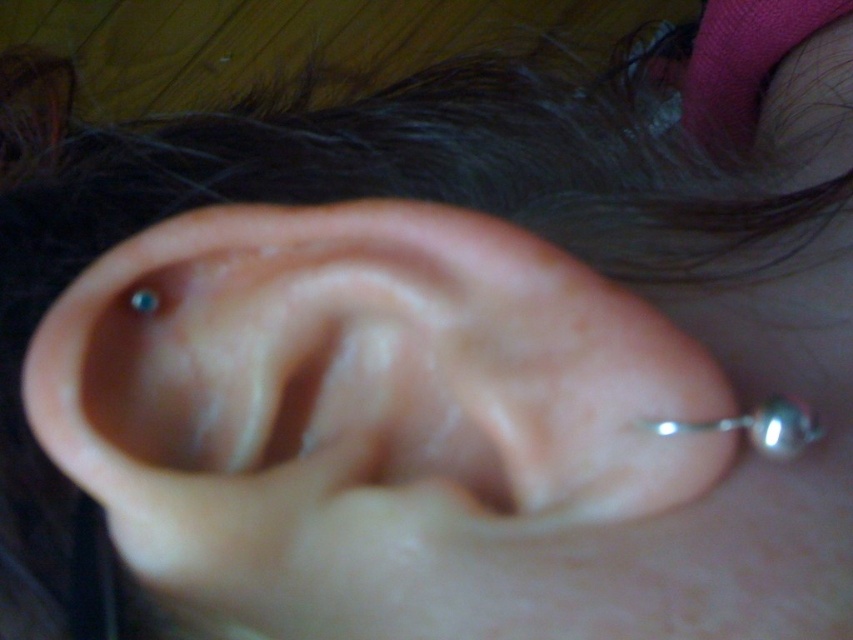
Consider the image. Between silver metallic ball at lower right and blue metallic earring at upper left, which one appears on the right side from the viewer's perspective?

From the viewer's perspective, silver metallic ball at lower right appears more on the right side.

The width and height of the screenshot is (853, 640). I want to click on silver metallic ball at lower right, so click(757, 426).

Is silver metallic ball at lower right to the right of silver metallic earring at upper left from the viewer's perspective?

Indeed, silver metallic ball at lower right is positioned on the right side of silver metallic earring at upper left.

Does silver metallic ball at lower right have a greater height compared to silver metallic earring at upper left?

Yes, silver metallic ball at lower right is taller than silver metallic earring at upper left.

Is point (769, 397) in front of point (161, 305)?

That is True.

This screenshot has width=853, height=640. Find the location of `silver metallic ball at lower right`. silver metallic ball at lower right is located at coordinates (757, 426).

Does pink flesh-colored ear at center appear over silver metallic ball at lower right?

Correct, pink flesh-colored ear at center is located above silver metallic ball at lower right.

Who is higher up, pink flesh-colored ear at center or silver metallic ball at lower right?

pink flesh-colored ear at center is above.

Is point (432, 435) positioned after point (788, 401)?

Yes, it is.

The width and height of the screenshot is (853, 640). In order to click on pink flesh-colored ear at center in this screenshot , I will do `click(363, 394)`.